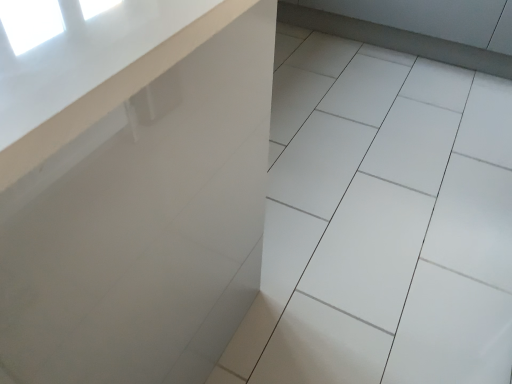
Question: Considering the relative positions of white glossy tile at center and white glossy counter at upper left in the image provided, is white glossy tile at center in front of white glossy counter at upper left?

Choices:
 (A) yes
 (B) no

Answer: (B)

Question: Is white glossy counter at upper left completely or partially inside white glossy tile at center?

Choices:
 (A) no
 (B) yes

Answer: (A)

Question: Could you tell me if white glossy tile at center is facing white glossy counter at upper left?

Choices:
 (A) no
 (B) yes

Answer: (A)

Question: Does white glossy tile at center have a smaller size compared to white glossy counter at upper left?

Choices:
 (A) no
 (B) yes

Answer: (B)

Question: From the image's perspective, is white glossy tile at center beneath white glossy counter at upper left?

Choices:
 (A) no
 (B) yes

Answer: (A)

Question: Is white glossy tile at center to the right of white glossy counter at upper left from the viewer's perspective?

Choices:
 (A) no
 (B) yes

Answer: (B)

Question: Is white glossy counter at upper left far from white glossy tile at center?

Choices:
 (A) no
 (B) yes

Answer: (A)

Question: Can you confirm if white glossy counter at upper left is thinner than white glossy tile at center?

Choices:
 (A) no
 (B) yes

Answer: (B)

Question: Considering the relative positions of white glossy counter at upper left and white glossy tile at center in the image provided, is white glossy counter at upper left behind white glossy tile at center?

Choices:
 (A) no
 (B) yes

Answer: (A)

Question: Is white glossy counter at upper left shorter than white glossy tile at center?

Choices:
 (A) no
 (B) yes

Answer: (A)

Question: Considering the relative positions of white glossy counter at upper left and white glossy tile at center in the image provided, is white glossy counter at upper left to the left of white glossy tile at center from the viewer's perspective?

Choices:
 (A) no
 (B) yes

Answer: (B)

Question: Considering the relative sizes of white glossy counter at upper left and white glossy tile at center in the image provided, is white glossy counter at upper left smaller than white glossy tile at center?

Choices:
 (A) yes
 (B) no

Answer: (B)

Question: Considering the positions of point (318, 365) and point (159, 340), is point (318, 365) closer or farther from the camera than point (159, 340)?

Choices:
 (A) closer
 (B) farther

Answer: (B)